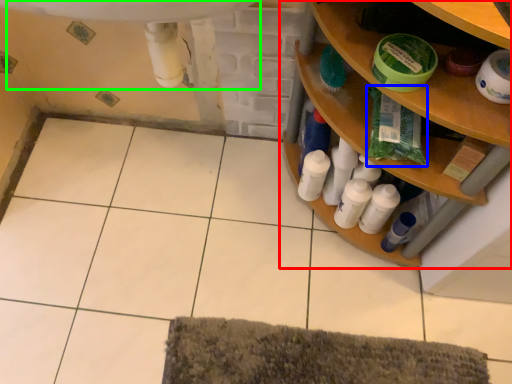
Question: Based on their relative distances, which object is farther from shelf (highlighted by a red box)? Choose from material (highlighted by a blue box) and sink (highlighted by a green box).

Choices:
 (A) material
 (B) sink

Answer: (B)